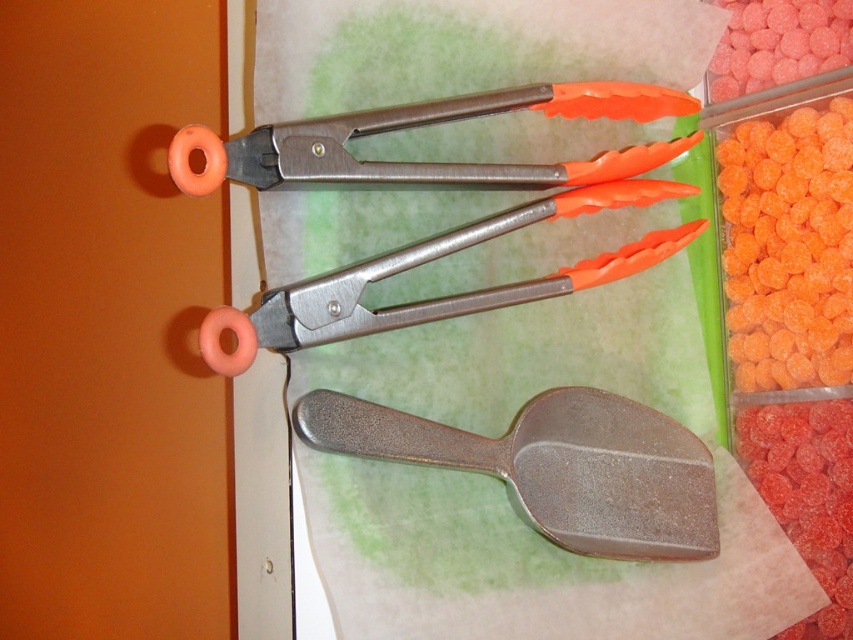
Question: Is orange rubber tongs at upper center above orange matte gumballs at upper right?

Choices:
 (A) no
 (B) yes

Answer: (A)

Question: Can you confirm if metallic gray spatula at center is positioned below orange rubber tongs at upper center?

Choices:
 (A) no
 (B) yes

Answer: (B)

Question: Which of the following is the farthest from the observer?

Choices:
 (A) metallic gray spatula at center
 (B) orange plastic tongs at upper center
 (C) orange rubber tongs at upper center

Answer: (A)

Question: Among these objects, which one is farthest from the camera?

Choices:
 (A) orange matte gumballs at upper right
 (B) metallic gray spatula at center
 (C) orange rubber tongs at upper center
 (D) orange plastic tongs at upper center

Answer: (A)

Question: Which point is farther to the camera?

Choices:
 (A) orange plastic tongs at upper center
 (B) orange rubber tongs at upper center

Answer: (A)

Question: Is orange rubber tongs at upper center to the right of orange matte gumballs at upper right from the viewer's perspective?

Choices:
 (A) no
 (B) yes

Answer: (A)